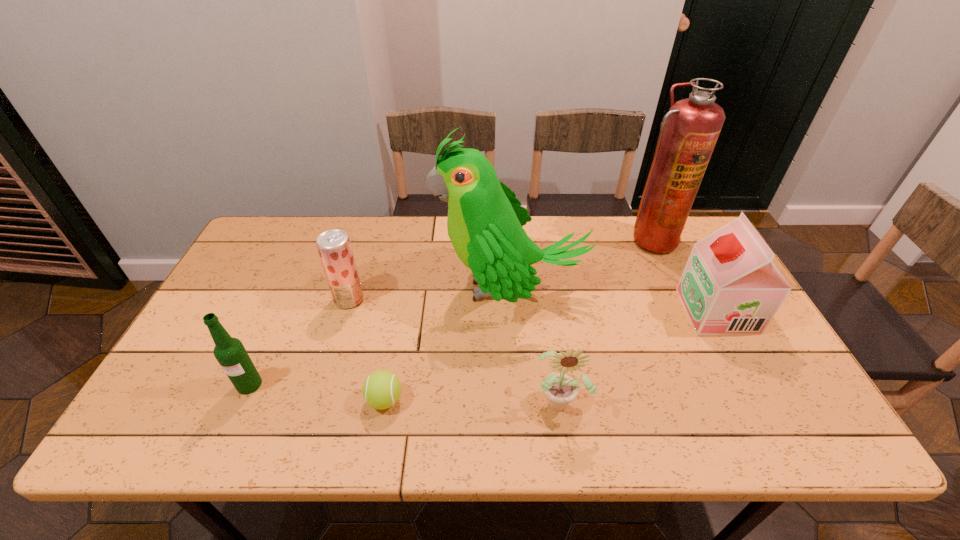
This screenshot has height=540, width=960. I want to click on fire extinguisher, so click(x=689, y=131).

Identify the location of parakeet. click(485, 220).

Locate an element on the screen. The image size is (960, 540). soya milk is located at coordinates (730, 286).

Identify the location of the leftmost object. (232, 356).

Identify the location of the second object from left to right. (334, 247).

Find the location of a particular element. This screenshot has width=960, height=540. sunflower is located at coordinates (560, 389).

The image size is (960, 540). I want to click on the third object from left to right, so click(x=381, y=390).

Find the location of a particular element. the shortest object is located at coordinates (381, 390).

Find the location of a particular element. Image resolution: width=960 pixels, height=540 pixels. free space located 0.230m on the side of the fire extinguisher with the label is located at coordinates (682, 309).

Where is `free space located 0.300m on the beak of the parakeet`? The height and width of the screenshot is (540, 960). free space located 0.300m on the beak of the parakeet is located at coordinates (333, 288).